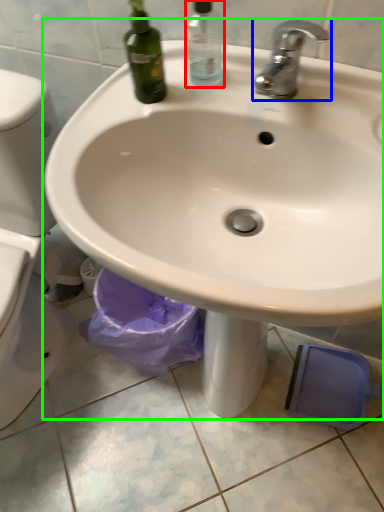
Question: Which object is the closest to the cleaning product (highlighted by a red box)? Choose among these: tap (highlighted by a blue box) or sink (highlighted by a green box).

Choices:
 (A) tap
 (B) sink

Answer: (A)